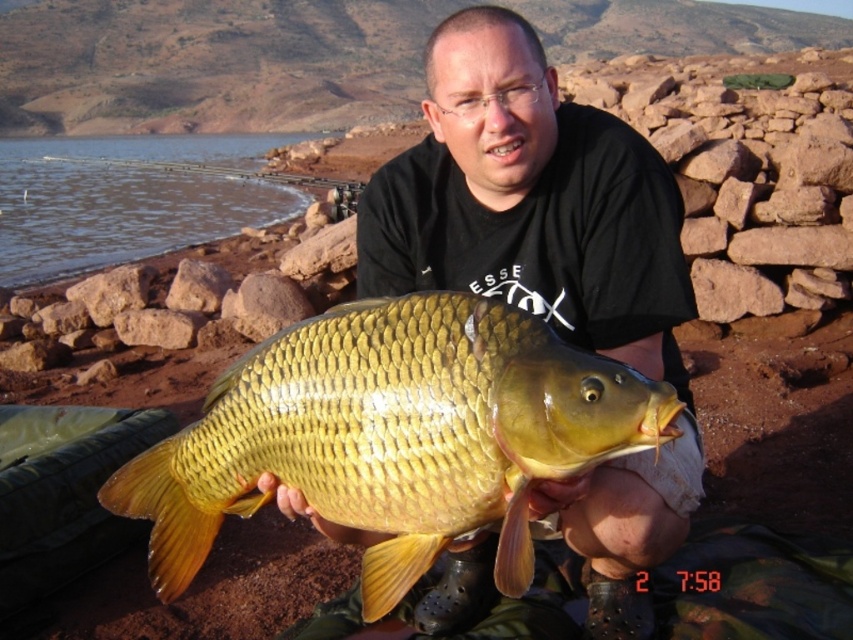
Does matte gold fish at center appear on the right side of shiny gold fish at center?

Indeed, matte gold fish at center is positioned on the right side of shiny gold fish at center.

Who is shorter, matte gold fish at center or shiny gold fish at center?

shiny gold fish at center is shorter.

The height and width of the screenshot is (640, 853). Describe the element at coordinates (531, 202) in the screenshot. I see `matte gold fish at center` at that location.

Identify the location of matte gold fish at center. The height and width of the screenshot is (640, 853). (531, 202).

Is shiny gold fish at center below brown smooth water at upper left?

Indeed, shiny gold fish at center is positioned under brown smooth water at upper left.

Which is in front, point (234, 449) or point (202, 136)?

Point (234, 449) is in front.

Find the location of a particular element. This screenshot has height=640, width=853. shiny gold fish at center is located at coordinates (393, 435).

Is point (573, 513) more distant than point (32, 237)?

No.

Can you confirm if matte gold fish at center is thinner than brown smooth water at upper left?

Yes, matte gold fish at center is thinner than brown smooth water at upper left.

Describe the element at coordinates (531, 202) in the screenshot. I see `matte gold fish at center` at that location.

I want to click on matte gold fish at center, so point(531,202).